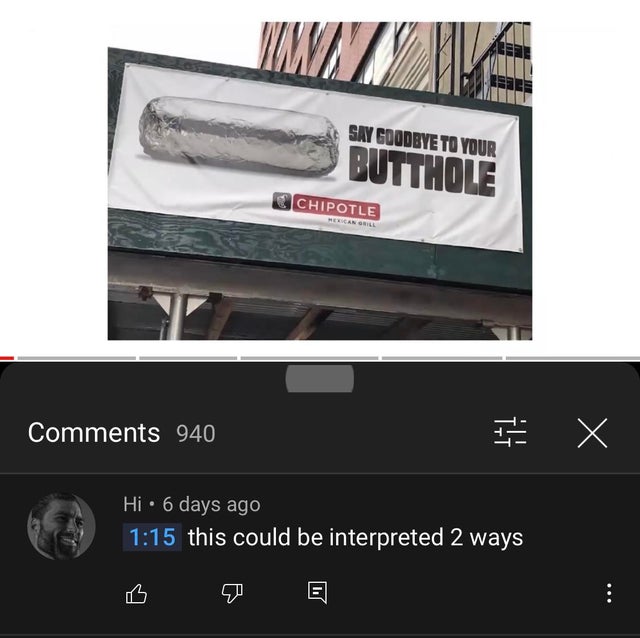
The image size is (640, 638). I want to click on stairs, so click(x=512, y=48).